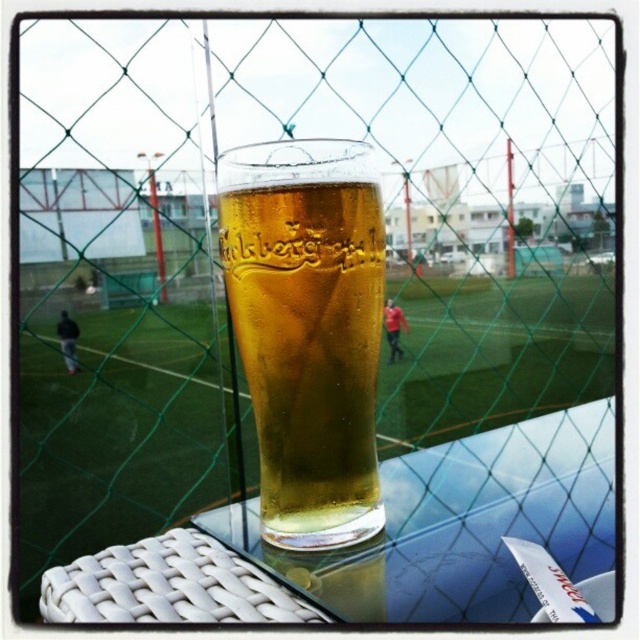
You are standing in front of a transparent glass table at center and a translucent glass beer at center. Which object would you need to reach out further to touch?

The translucent glass beer at center is further away from you than the transparent glass table at center, so you would need to reach out further to touch it.

You are standing outside the chainlink fence in the scene and want to place a transparent glass table at center in the grassy field. Based on the coordinates provided, will the table be placed within the grassy field or behind the urban structures?

The transparent glass table at center is located at point (381, 540), which places it within the grassy field between the fence and the urban structures, so it will be placed in the grassy field.